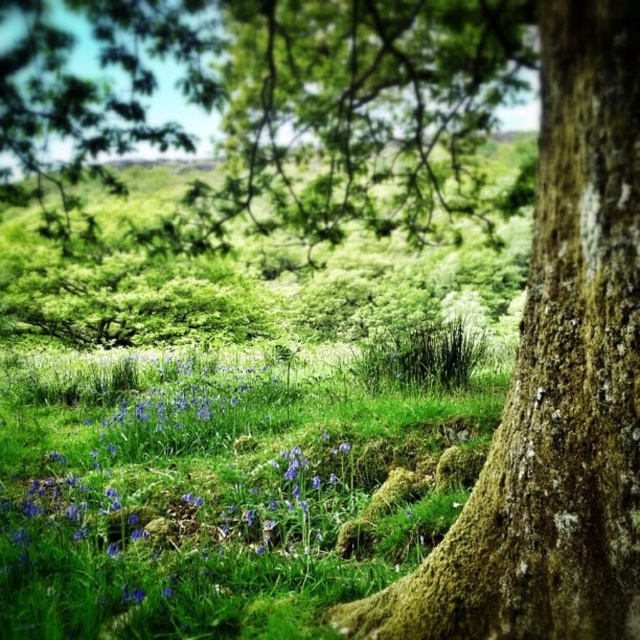
Question: Does green grassy patch at center appear under mossy bark tree trunk at center-right?

Choices:
 (A) no
 (B) yes

Answer: (B)

Question: Which object is the farthest from the green grassy patch at center?

Choices:
 (A) mossy bark tree trunk at center-right
 (B) green mossy tree at center

Answer: (A)

Question: Does green grassy patch at center have a greater width compared to green mossy tree at center?

Choices:
 (A) yes
 (B) no

Answer: (A)

Question: From the image, what is the correct spatial relationship of green grassy patch at center in relation to green mossy tree at center?

Choices:
 (A) left
 (B) right

Answer: (A)

Question: Considering the real-world distances, which object is farthest from the green mossy tree at center?

Choices:
 (A) mossy bark tree trunk at center-right
 (B) green grassy patch at center

Answer: (A)

Question: Which point appears farthest from the camera in this image?

Choices:
 (A) (403, 221)
 (B) (99, 396)

Answer: (B)